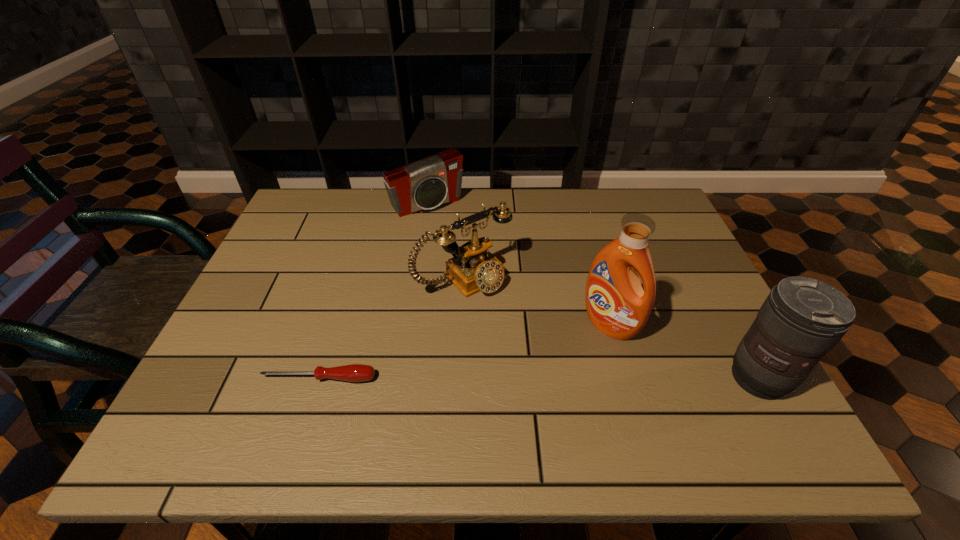
The image size is (960, 540). Find the location of `free space between the second tallest object and the detergent`. free space between the second tallest object and the detergent is located at coordinates (684, 352).

This screenshot has height=540, width=960. I want to click on free spot between the camera and the tallest object, so click(x=518, y=265).

Where is `free area in between the second tallest object and the tallest object`? The width and height of the screenshot is (960, 540). free area in between the second tallest object and the tallest object is located at coordinates (684, 352).

Where is `free space between the second shortest object and the detergent`? The image size is (960, 540). free space between the second shortest object and the detergent is located at coordinates (518, 265).

Identify the location of free space between the telephoto lens and the screwdriver. The image size is (960, 540). (540, 378).

Select which object is the closest to the third tallest object. Please provide its 2D coordinates. Your answer should be formatted as a tuple, i.e. [(x, y)], where the tuple contains the x and y coordinates of a point satisfying the conditions above.

[(617, 305)]

You are a GUI agent. You are given a task and a screenshot of the screen. Output one action in this format:
    pyautogui.click(x=<x>, y=<y>)
    Task: Click on the object that stands as the second closest to the third shortest object
    This screenshot has height=540, width=960.
    Given the screenshot: What is the action you would take?
    [x=436, y=180]

The width and height of the screenshot is (960, 540). I want to click on blank area in the image that satisfies the following two spatial constraints: 1. on the front side of the fourth tallest object; 2. on the right side of the second object from right to left, so click(408, 325).

Image resolution: width=960 pixels, height=540 pixels. What are the coordinates of `free space that satisfies the following two spatial constraints: 1. at the tip of the shortest object; 2. on the side of the rightmost object where the control switches are located` in the screenshot? It's located at (319, 378).

Identify the location of vacant space that satisfies the following two spatial constraints: 1. at the tip of the fourth shortest object; 2. on the side of the shortest object where the control switches are located. The image size is (960, 540). (319, 378).